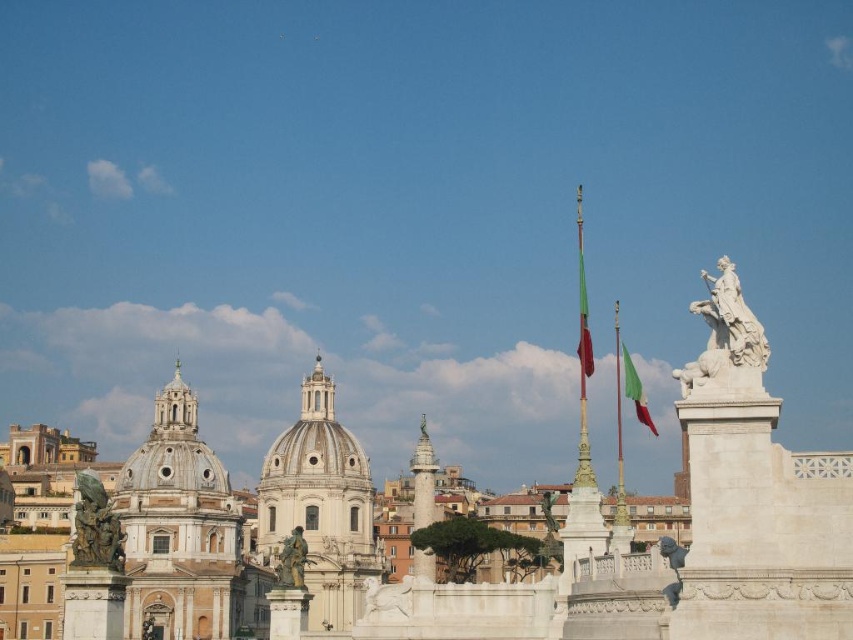
Question: Which of the following is the closest to the observer?

Choices:
 (A) (653, 422)
 (B) (579, 284)

Answer: (A)

Question: Is white marble statue at upper right below green fabric flag at center?

Choices:
 (A) yes
 (B) no

Answer: (A)

Question: Based on their relative distances, which object is nearer to the green fabric flag at center-right?

Choices:
 (A) green fabric flag at center
 (B) white marble statue at upper right
 (C) bronze statue at left

Answer: (A)

Question: Based on their relative distances, which object is nearer to the green fabric flag at center?

Choices:
 (A) white marble statue at upper right
 (B) white marble statue at center

Answer: (A)

Question: Is white marble statue at center closer to camera compared to bronze statue at left?

Choices:
 (A) yes
 (B) no

Answer: (A)

Question: Can you confirm if white marble statue at upper right is positioned below bronze statue at left?

Choices:
 (A) no
 (B) yes

Answer: (A)